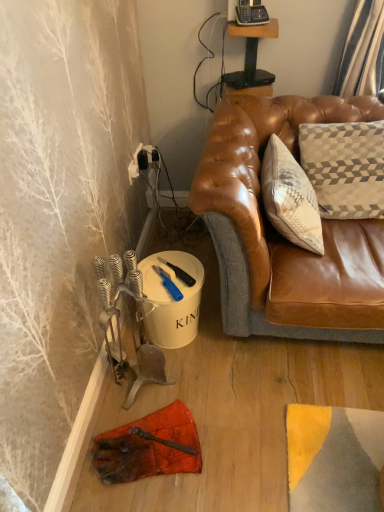
Question: From a real-world perspective, is blue plastic knife at lower center, arranged as the 2th tool when ordered from the bottom, positioned over wooden table at upper center based on gravity?

Choices:
 (A) yes
 (B) no

Answer: (B)

Question: Is blue plastic knife at lower center, arranged as the 2th tool when ordered from the bottom, to the right of wooden table at upper center from the viewer's perspective?

Choices:
 (A) yes
 (B) no

Answer: (B)

Question: Is blue plastic knife at lower center, the first tool from the top, facing towards wooden table at upper center?

Choices:
 (A) no
 (B) yes

Answer: (A)

Question: Is blue plastic knife at lower center, arranged as the 2th tool when ordered from the bottom, closer to the viewer compared to wooden table at upper center?

Choices:
 (A) yes
 (B) no

Answer: (A)

Question: Would you say blue plastic knife at lower center, the first tool from the top, is outside wooden table at upper center?

Choices:
 (A) yes
 (B) no

Answer: (A)

Question: Is blue plastic knife at lower center, arranged as the 2th tool when ordered from the bottom, spatially inside wooden table at upper center, or outside of it?

Choices:
 (A) inside
 (B) outside

Answer: (B)

Question: From a real-world perspective, is blue plastic knife at lower center, arranged as the 2th tool when ordered from the bottom, positioned above or below wooden table at upper center?

Choices:
 (A) above
 (B) below

Answer: (B)

Question: Visually, is blue plastic knife at lower center, the first tool from the top, positioned to the left or to the right of wooden table at upper center?

Choices:
 (A) right
 (B) left

Answer: (B)

Question: From the image's perspective, relative to wooden table at upper center, is blue plastic knife at lower center, the first tool from the top, above or below?

Choices:
 (A) below
 (B) above

Answer: (A)

Question: In terms of width, does wooden table at upper center look wider or thinner when compared to blue plastic utility knife at lower center, the first tool when ordered from bottom to top?

Choices:
 (A) thin
 (B) wide

Answer: (A)

Question: From the image's perspective, relative to blue plastic utility knife at lower center, the first tool when ordered from bottom to top, is wooden table at upper center above or below?

Choices:
 (A) below
 (B) above

Answer: (B)

Question: Does point (261, 31) appear closer or farther from the camera than point (160, 275)?

Choices:
 (A) farther
 (B) closer

Answer: (A)

Question: Is wooden table at upper center in front of or behind blue plastic utility knife at lower center, the first tool when ordered from bottom to top, in the image?

Choices:
 (A) behind
 (B) front

Answer: (A)

Question: Considering the positions of blue plastic utility knife at lower center, the first tool when ordered from bottom to top, and blue plastic knife at lower center, the first tool from the top, in the image, is blue plastic utility knife at lower center, the first tool when ordered from bottom to top, taller or shorter than blue plastic knife at lower center, the first tool from the top,?

Choices:
 (A) short
 (B) tall

Answer: (B)

Question: From a real-world perspective, relative to blue plastic knife at lower center, the first tool from the top, is blue plastic utility knife at lower center, the 2th tool when ordered from top to bottom, vertically above or below?

Choices:
 (A) below
 (B) above

Answer: (A)